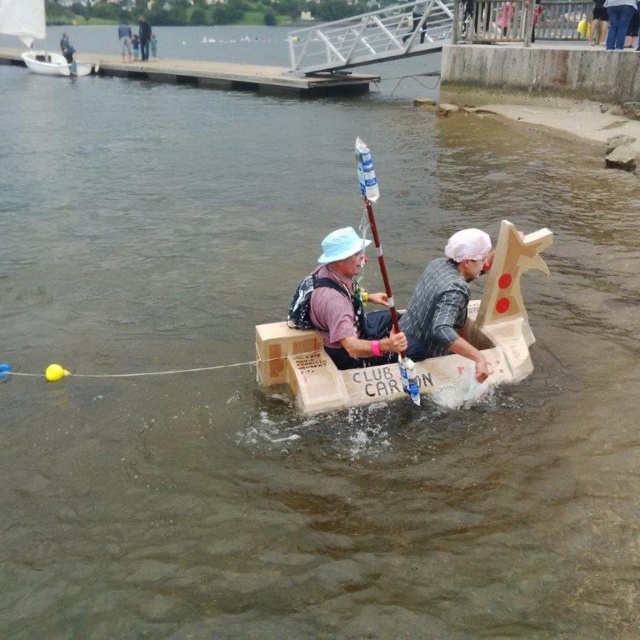
Can you confirm if white plastic paddle at center is positioned below brushed metal water at bottle left?

Yes.

Between white plastic paddle at center and brushed metal water at bottle left, which one is positioned higher?

brushed metal water at bottle left

Identify the location of white plastic paddle at center. This screenshot has width=640, height=640. (372, 216).

Is point (36, 70) positioned in front of point (141, 60)?

Yes.

Who is positioned more to the left, white plastic boat at upper left or light blue fabric hat at center?

From the viewer's perspective, white plastic boat at upper left appears more on the left side.

Who is more distant from viewer, (52,72) or (145,26)?

Positioned behind is point (145,26).

Where is `white plastic boat at upper left`? white plastic boat at upper left is located at coordinates (54, 64).

From the picture: Does striped fabric shirt at center appear on the right side of white matte hat at upper center?

→ In fact, striped fabric shirt at center is to the left of white matte hat at upper center.

Which of these two, striped fabric shirt at center or white matte hat at upper center, stands shorter?

white matte hat at upper center is shorter.

Identify the location of striped fabric shirt at center. The height and width of the screenshot is (640, 640). (448, 298).